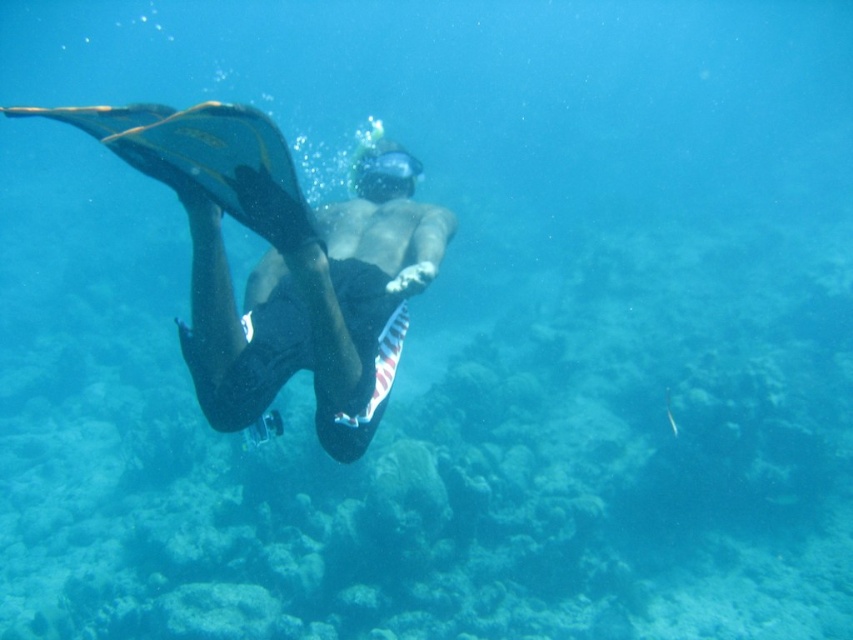
Question: Does black matte shorts at center come in front of transparent rubber goggles at center?

Choices:
 (A) no
 (B) yes

Answer: (B)

Question: Among these points, which one is farthest from the camera?

Choices:
 (A) pyautogui.click(x=415, y=212)
 (B) pyautogui.click(x=372, y=156)

Answer: (B)

Question: Which point is farther to the camera?

Choices:
 (A) 357,166
 (B) 248,392

Answer: (A)

Question: Considering the relative positions of black matte shorts at center and transparent rubber goggles at center in the image provided, where is black matte shorts at center located with respect to transparent rubber goggles at center?

Choices:
 (A) above
 (B) below

Answer: (B)

Question: From the image, what is the correct spatial relationship of black matte shorts at center in relation to transparent rubber goggles at center?

Choices:
 (A) right
 (B) left

Answer: (B)